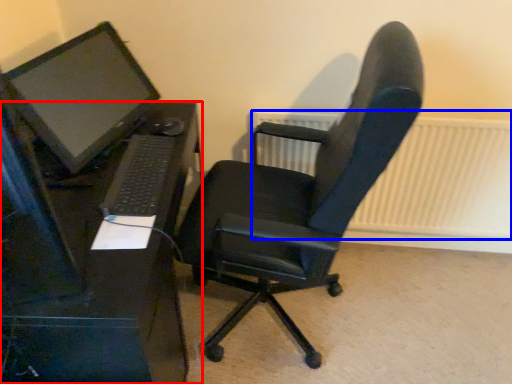
Question: Which object appears farthest to the camera in this image, desk (highlighted by a red box) or radiator (highlighted by a blue box)?

Choices:
 (A) desk
 (B) radiator

Answer: (B)